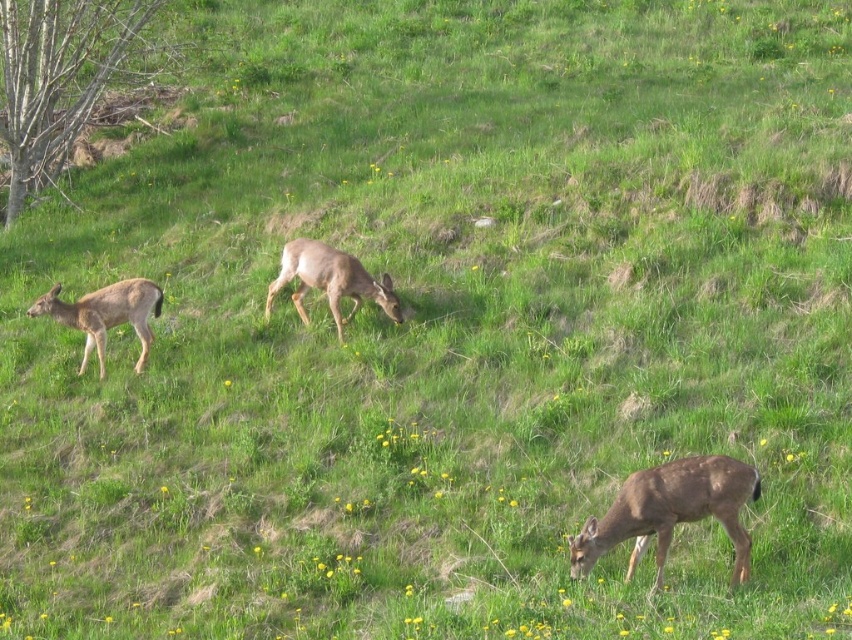
Question: Which point is farther to the camera?

Choices:
 (A) brown matte deer at lower right
 (B) brown fur deer at left
 (C) brown matte deer at center

Answer: (B)

Question: Which point is closer to the camera?

Choices:
 (A) brown matte deer at lower right
 (B) brown fur deer at left
 (C) brown matte deer at center

Answer: (A)

Question: Among these objects, which one is nearest to the camera?

Choices:
 (A) brown fur deer at left
 (B) brown matte deer at center
 (C) brown matte deer at lower right

Answer: (C)

Question: Does brown matte deer at lower right appear on the right side of brown fur deer at left?

Choices:
 (A) no
 (B) yes

Answer: (B)

Question: Can you confirm if brown matte deer at lower right is positioned above brown fur deer at left?

Choices:
 (A) no
 (B) yes

Answer: (A)

Question: Considering the relative positions of brown matte deer at lower right and brown fur deer at left in the image provided, where is brown matte deer at lower right located with respect to brown fur deer at left?

Choices:
 (A) below
 (B) above

Answer: (A)